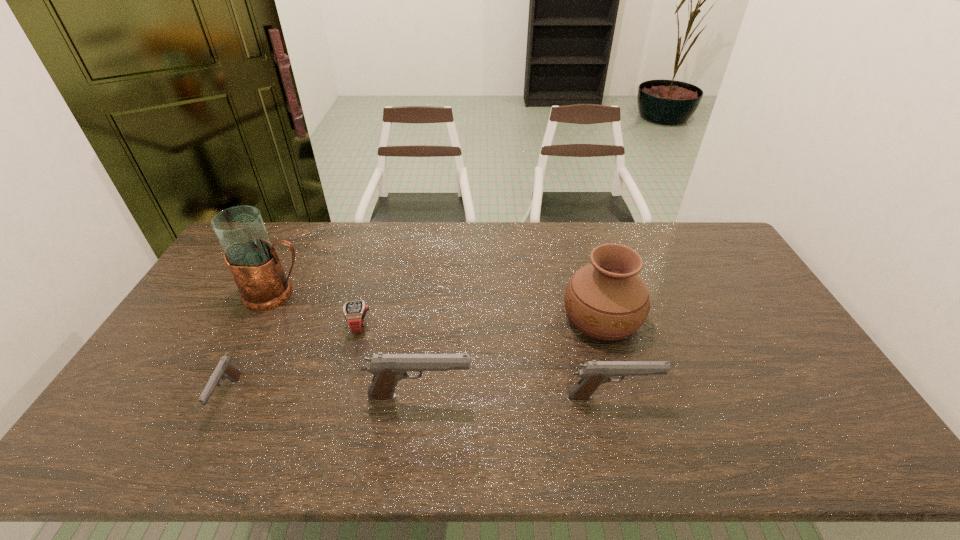
Where is `free space between the shortest pistol and the watch`? The width and height of the screenshot is (960, 540). free space between the shortest pistol and the watch is located at coordinates (294, 361).

Find the location of a particular element. The image size is (960, 540). free point between the shortest pistol and the second pistol from right to left is located at coordinates (324, 396).

You are a GUI agent. You are given a task and a screenshot of the screen. Output one action in this format:
    pyautogui.click(x=<x>, y=<y>)
    Task: Click on the vacant area between the shortest pistol and the tallest object
    Image resolution: width=960 pixels, height=540 pixels.
    Given the screenshot: What is the action you would take?
    pyautogui.click(x=252, y=345)

Identify the location of vacant region between the shortest pistol and the shortest object. This screenshot has height=540, width=960. point(294,361).

Locate an element on the screen. vacant region between the pitcher and the fourth object from left to right is located at coordinates (348, 345).

This screenshot has width=960, height=540. Identify the location of free space that is in between the second pistol from right to left and the urn. (511, 356).

Where is `empty location between the shortest pistol and the third object from left to right`? empty location between the shortest pistol and the third object from left to right is located at coordinates (294, 361).

You are a GUI agent. You are given a task and a screenshot of the screen. Output one action in this format:
    pyautogui.click(x=<x>, y=<y>)
    Task: Click on the fourth closest object to the watch
    
    Given the screenshot: What is the action you would take?
    pyautogui.click(x=607, y=300)

Select which object appears as the second closest to the watch. Please provide its 2D coordinates. Your answer should be formatted as a tuple, i.e. [(x, y)], where the tuple contains the x and y coordinates of a point satisfying the conditions above.

[(388, 369)]

The image size is (960, 540). Identify the location of the closest pistol to the leftmost pistol. [388, 369].